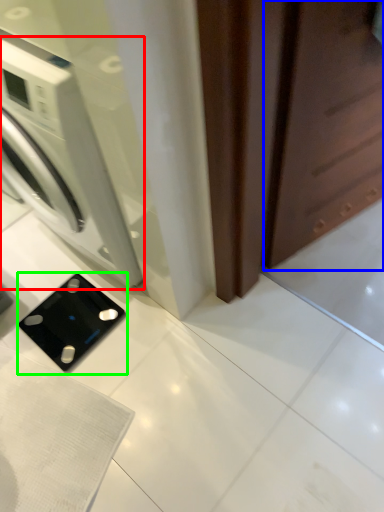
Question: Considering the real-world distances, which object is farthest from washing machine (highlighted by a red box)? screen door (highlighted by a blue box) or appliance (highlighted by a green box)?

Choices:
 (A) screen door
 (B) appliance

Answer: (A)